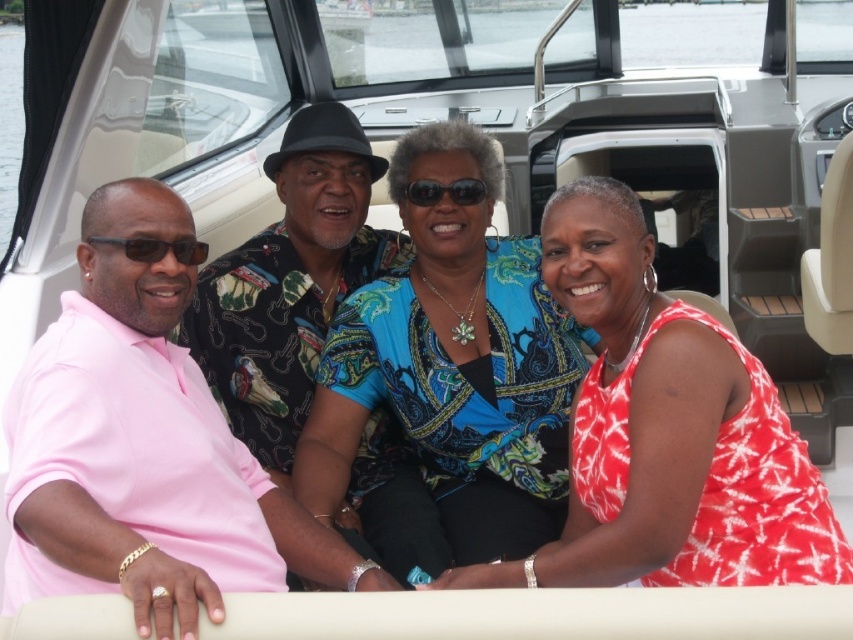
Does printed fabric shirt at center have a larger size compared to black plastic sunglasses at center?

Indeed, printed fabric shirt at center has a larger size compared to black plastic sunglasses at center.

Can you confirm if printed fabric shirt at center is thinner than black plastic sunglasses at center?

In fact, printed fabric shirt at center might be wider than black plastic sunglasses at center.

I want to click on printed fabric shirt at center, so click(x=289, y=282).

Does pink cotton polo shirt at left appear on the right side of printed cotton dress at center?

Incorrect, pink cotton polo shirt at left is not on the right side of printed cotton dress at center.

Is point (216, 404) positioned after point (602, 460)?

No, it is in front of (602, 460).

Where is `pink cotton polo shirt at left`? pink cotton polo shirt at left is located at coordinates (149, 449).

Can you confirm if printed fabric shirt at center is positioned below matte black sunglasses at left?

Correct, printed fabric shirt at center is located below matte black sunglasses at left.

Can you confirm if printed fabric shirt at center is taller than matte black sunglasses at left?

Indeed, printed fabric shirt at center has a greater height compared to matte black sunglasses at left.

Does point (376, 490) come farther from viewer compared to point (195, 257)?

Yes, it is.

Where is `printed fabric shirt at center`? printed fabric shirt at center is located at coordinates (289, 282).